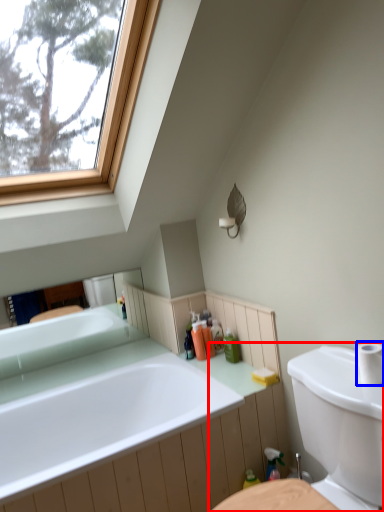
Question: Which object appears closest to the camera in this image, sink (highlighted by a red box) or toilet paper (highlighted by a blue box)?

Choices:
 (A) sink
 (B) toilet paper

Answer: (A)